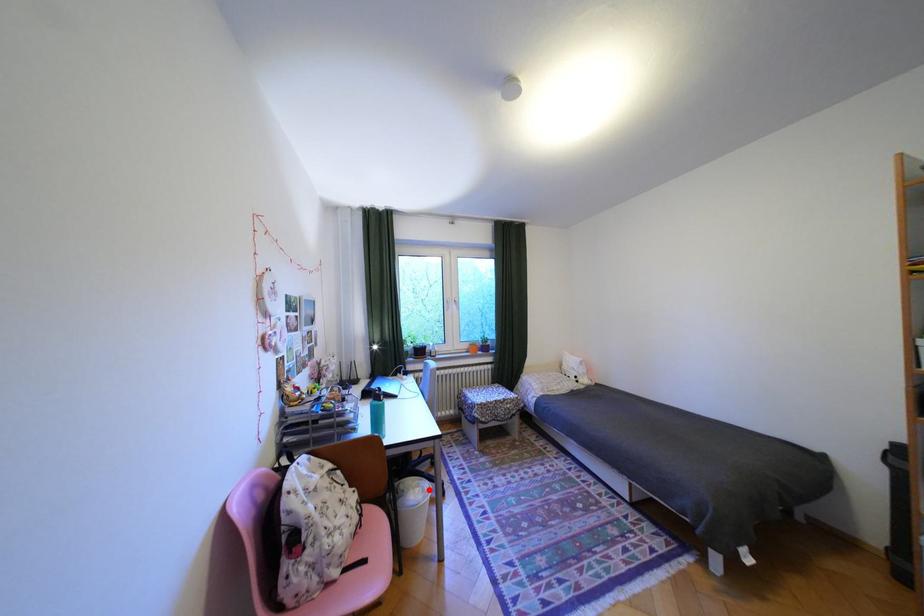
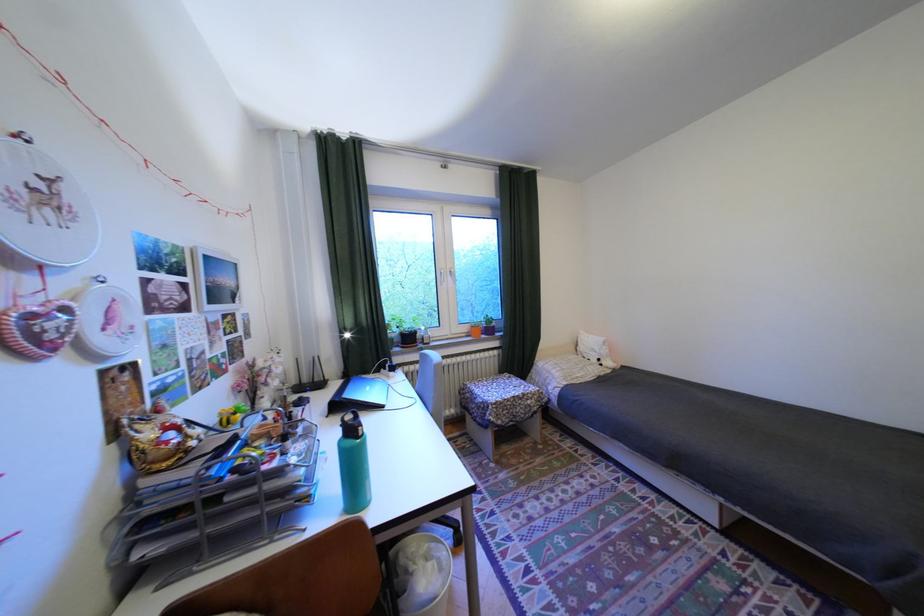
Question: I am providing you with two images of the same scene from different viewpoints. Image1 has a red point marked. In image2, the corresponding 3D location appears at what relative position? Reply with the corresponding letter.

Choices:
 (A) Closer
 (B) Farther

Answer: (B)